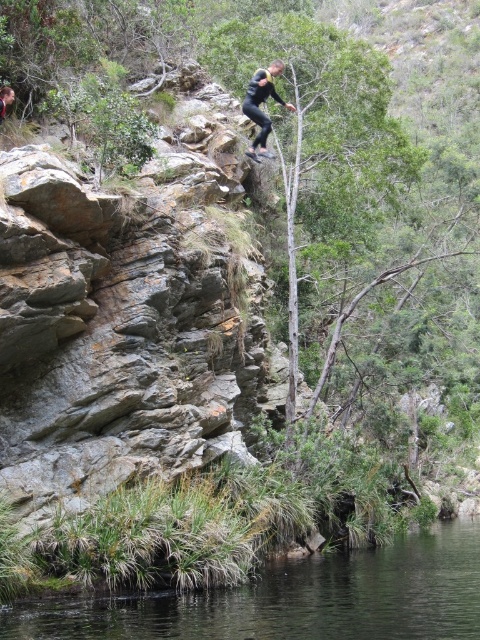
Between clear water at lower center and black matte clothing at center, which one has more height?

black matte clothing at center

Is point (408, 588) in front of point (273, 81)?

Yes, it is in front of point (273, 81).

Does point (286, 600) lie in front of point (267, 92)?

Yes.

Find the location of a particular element. The height and width of the screenshot is (640, 480). clear water at lower center is located at coordinates click(298, 600).

Can you confirm if black matte clothing at center is shorter than black matte clothing at upper center?

No, black matte clothing at center is not shorter than black matte clothing at upper center.

Between black matte clothing at center and black matte clothing at upper center, which one appears on the left side from the viewer's perspective?

Positioned to the left is black matte clothing at upper center.

Identify the location of black matte clothing at center. (260, 104).

Between clear water at lower center and black matte clothing at upper center, which one is positioned lower?

clear water at lower center is lower down.

Between point (474, 628) and point (4, 90), which one is positioned behind?

The point (4, 90) is behind.

Identify the location of clear water at lower center. [298, 600].